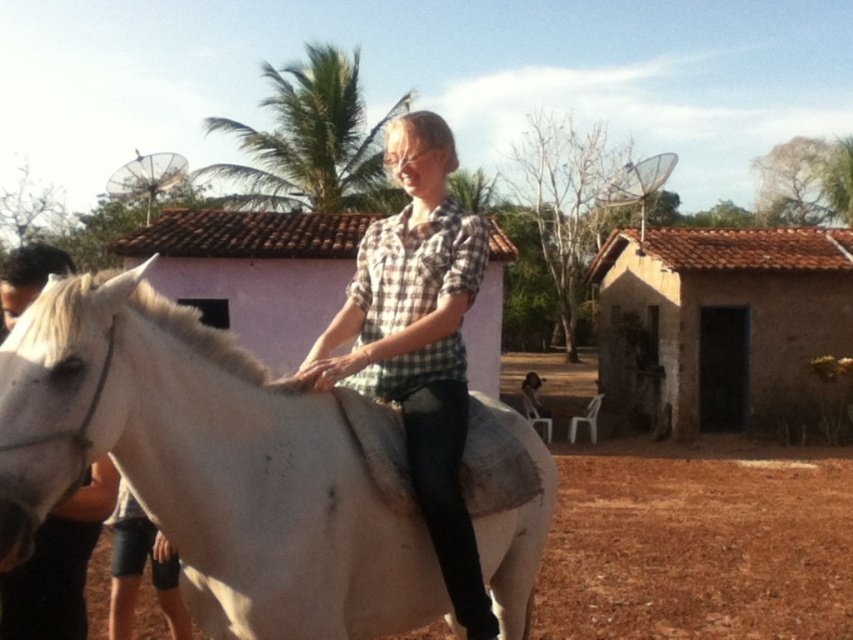
Locate an element on the screen. The image size is (853, 640). brown dirt field at lower center is located at coordinates (699, 544).

Does brown dirt field at lower center appear on the right side of checkered fabric shirt at center?

Yes, brown dirt field at lower center is to the right of checkered fabric shirt at center.

Describe the element at coordinates (699, 544) in the screenshot. The height and width of the screenshot is (640, 853). I see `brown dirt field at lower center` at that location.

Identify the location of brown dirt field at lower center. This screenshot has height=640, width=853. (699, 544).

Who is taller, white matte horse at center or white matte horse at left?

white matte horse at center

Based on the photo, can you confirm if white matte horse at center is bigger than white matte horse at left?

Indeed, white matte horse at center has a larger size compared to white matte horse at left.

What are the coordinates of `white matte horse at center` in the screenshot? It's located at (207, 465).

Does white matte horse at center have a greater width compared to pink stucco hut at center?

In fact, white matte horse at center might be narrower than pink stucco hut at center.

Between point (158, 308) and point (289, 330), which one is positioned behind?

The point (289, 330) is behind.

Find the location of a particular element. The width and height of the screenshot is (853, 640). white matte horse at center is located at coordinates (207, 465).

The height and width of the screenshot is (640, 853). I want to click on white matte horse at center, so click(207, 465).